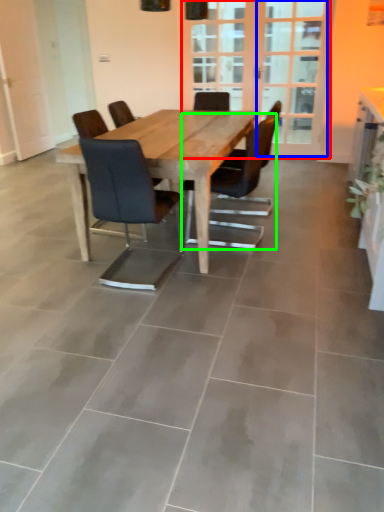
Question: Which object is the closest to the screen door (highlighted by a red box)? Choose among these: screen door (highlighted by a blue box) or chair (highlighted by a green box).

Choices:
 (A) screen door
 (B) chair

Answer: (A)